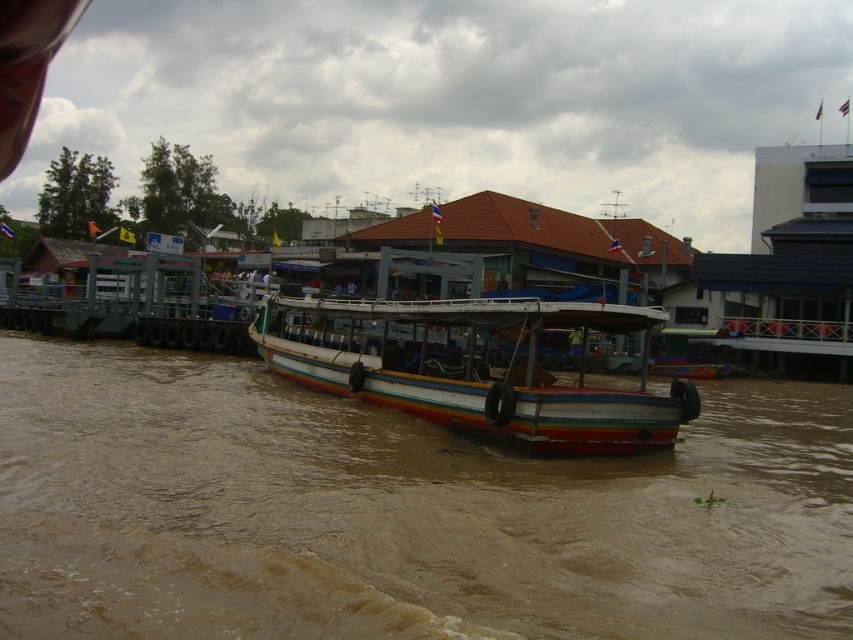
In the scene shown: You are standing on the dock and want to board the rainbow painted wood boat at center. The brown muddy water at center is between you and the boat. Can you step onto the boat without getting your feet wet?

The brown muddy water at center has a lesser height compared to rainbow painted wood boat at center, so the boat is higher than the water level. Therefore, you can step onto the boat without getting your feet wet as the boat is elevated above the brown muddy water at center.

You are a fisherman who needs to check the water level under your boat. Based on the scene, can you determine if the brown muddy water at center is located below the rainbow painted wood boat at center?

Yes, the brown muddy water at center is positioned under the rainbow painted wood boat at center, so the water is indeed located below the boat.

You are standing on the riverside dock and notice a point marked at coordinates (398, 513). What is located at that point?

The point at coordinates (398, 513) is occupied by brown muddy water at center.